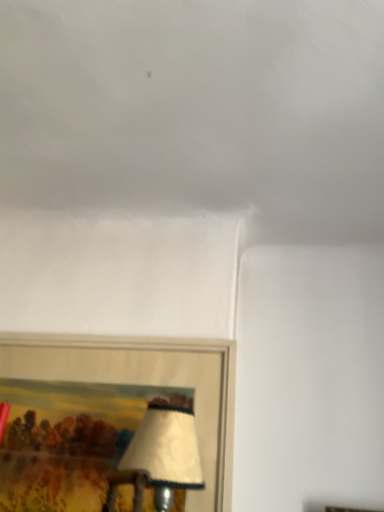
Describe the element at coordinates (147, 383) in the screenshot. I see `wooden picture frame at lower left` at that location.

Find the location of a particular element. wooden picture frame at lower left is located at coordinates (147, 383).

Image resolution: width=384 pixels, height=512 pixels. What are the coordinates of `white matte cloud at upper center` in the screenshot? It's located at (199, 111).

This screenshot has width=384, height=512. What do you see at coordinates (199, 111) in the screenshot?
I see `white matte cloud at upper center` at bounding box center [199, 111].

Image resolution: width=384 pixels, height=512 pixels. I want to click on wooden picture frame at lower left, so click(x=147, y=383).

Considering the relative positions of wooden picture frame at lower left and white matte cloud at upper center in the image provided, is wooden picture frame at lower left to the left or to the right of white matte cloud at upper center?

From the image, it's evident that wooden picture frame at lower left is to the left of white matte cloud at upper center.

Is wooden picture frame at lower left positioned in front of white matte cloud at upper center?

No.

Considering the positions of points (93, 377) and (154, 64), is point (93, 377) farther from camera compared to point (154, 64)?

Yes, it is behind point (154, 64).

From the image's perspective, is wooden picture frame at lower left located above white matte cloud at upper center?

Actually, wooden picture frame at lower left appears below white matte cloud at upper center in the image.

From a real-world perspective, who is located lower, wooden picture frame at lower left or white matte cloud at upper center?

From a 3D spatial view, wooden picture frame at lower left is below.

Looking at their sizes, would you say wooden picture frame at lower left is wider or thinner than white matte cloud at upper center?

wooden picture frame at lower left is thinner than white matte cloud at upper center.

Can you confirm if wooden picture frame at lower left is taller than white matte cloud at upper center?

Yes, wooden picture frame at lower left is taller than white matte cloud at upper center.

Who is smaller, wooden picture frame at lower left or white matte cloud at upper center?

Smaller between the two is wooden picture frame at lower left.

Is wooden picture frame at lower left not within white matte cloud at upper center?

Yes, wooden picture frame at lower left is outside of white matte cloud at upper center.

Consider the image. Is wooden picture frame at lower left not close to white matte cloud at upper center?

No, wooden picture frame at lower left is in close proximity to white matte cloud at upper center.

Is wooden picture frame at lower left aimed at white matte cloud at upper center?

No, wooden picture frame at lower left does not turn towards white matte cloud at upper center.

What are the coordinates of `cloud above the wooden picture frame at lower left (from the image's perspective)` in the screenshot? It's located at (x=199, y=111).

Considering the positions of objects white matte cloud at upper center and wooden picture frame at lower left in the image provided, who is more to the left, white matte cloud at upper center or wooden picture frame at lower left?

From the viewer's perspective, wooden picture frame at lower left appears more on the left side.

Between white matte cloud at upper center and wooden picture frame at lower left, which one is positioned in front?

white matte cloud at upper center is closer to the camera.

Is point (295, 27) closer to viewer compared to point (45, 356)?

Yes, point (295, 27) is closer to viewer.

From the image's perspective, which is below, white matte cloud at upper center or wooden picture frame at lower left?

wooden picture frame at lower left is shown below in the image.

From a real-world perspective, relative to wooden picture frame at lower left, is white matte cloud at upper center vertically above or below?

white matte cloud at upper center is above wooden picture frame at lower left.

Does white matte cloud at upper center have a lesser width compared to wooden picture frame at lower left?

Incorrect, the width of white matte cloud at upper center is not less than that of wooden picture frame at lower left.

In terms of height, does white matte cloud at upper center look taller or shorter compared to wooden picture frame at lower left?

Considering their sizes, white matte cloud at upper center has less height than wooden picture frame at lower left.

Between white matte cloud at upper center and wooden picture frame at lower left, which one has larger size?

white matte cloud at upper center.

Is white matte cloud at upper center surrounding wooden picture frame at lower left?

No.

Is white matte cloud at upper center beside wooden picture frame at lower left?

No, white matte cloud at upper center is not touching wooden picture frame at lower left.

Could you tell me if white matte cloud at upper center is turned towards wooden picture frame at lower left?

No, white matte cloud at upper center is not oriented towards wooden picture frame at lower left.

How different are the orientations of white matte cloud at upper center and wooden picture frame at lower left in degrees?

→ The facing directions of white matte cloud at upper center and wooden picture frame at lower left are 0.54 degrees apart.

Identify the location of cloud in front of the wooden picture frame at lower left. The image size is (384, 512). (199, 111).

Locate an element on the screen. picture frame on the left of the white matte cloud at upper center is located at coordinates (147, 383).

Where is `cloud in front of the wooden picture frame at lower left`? This screenshot has height=512, width=384. cloud in front of the wooden picture frame at lower left is located at coordinates (199, 111).